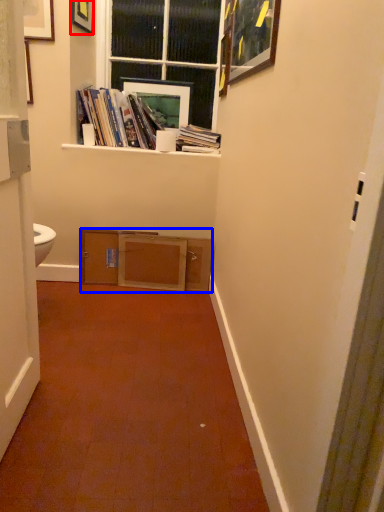
Question: Which object appears farthest to the camera in this image, picture frame (highlighted by a red box) or cabinetry (highlighted by a blue box)?

Choices:
 (A) picture frame
 (B) cabinetry

Answer: (B)